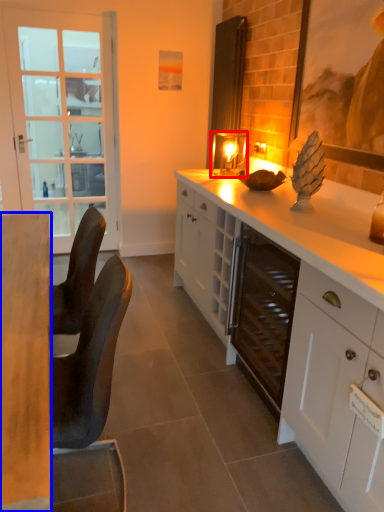
Question: Which point is closer to the camera, candle holder (highlighted by a red box) or desk (highlighted by a blue box)?

Choices:
 (A) candle holder
 (B) desk

Answer: (B)